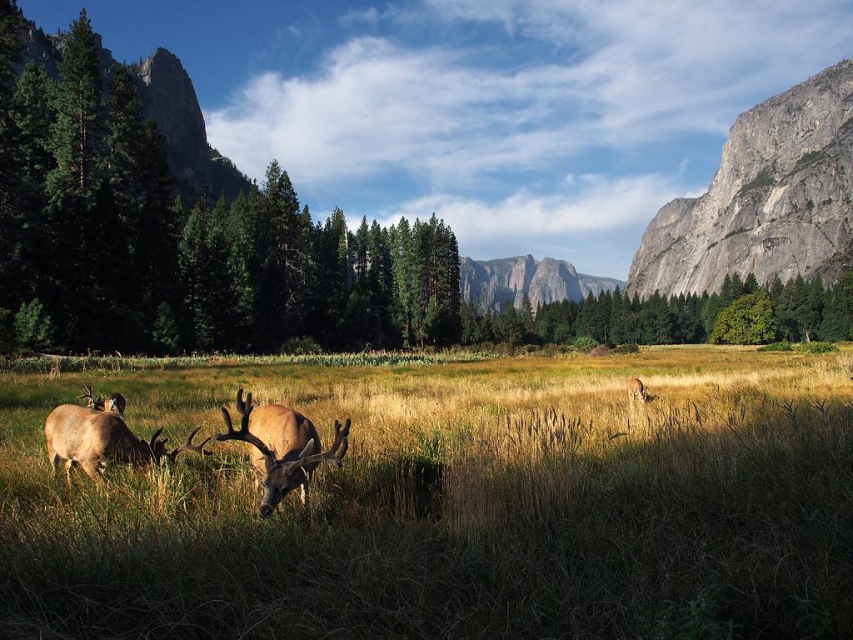
You are an observer standing in the meadow and see the green textured pine tree at left and the brown velvet deer at center. Which object is closer to you?

The green textured pine tree at left is closer to you because the brown velvet deer at center is behind it.

You are standing at the camera position and want to reach the point marked at coordinates point (151,211). If your walking speed is 3 miles per hour, how long will it take you to reach that point?

The point marked at coordinates point (151,211) is 200.24 feet away from the camera. Converting feet to miles, 200.24 feet is approximately 0.038 miles. At a walking speed of 3 miles per hour, it would take roughly 0.038 divided by 3 hours, which is about 0.0127 hours. Multiplying by 60 gives approximately 0.76 minutes, so roughly 46 seconds to reach the point.

You are an artist sketching the scene and want to draw the golden grass at center and the brown velvet antlers at left. Which object should you sketch first if you follow the left to right drawing order?

You should sketch the brown velvet antlers at left first because they are positioned to the left of the golden grass at center.